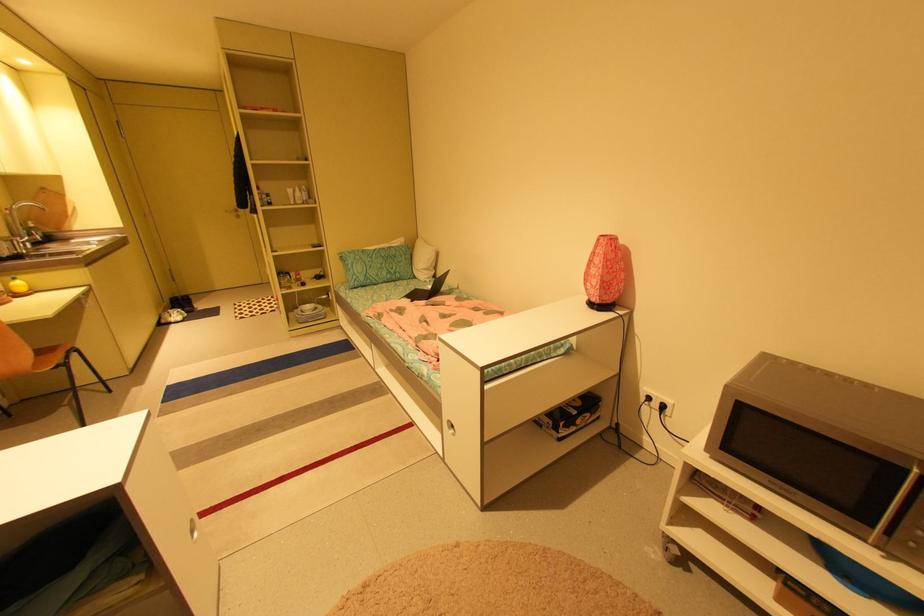
The height and width of the screenshot is (616, 924). What do you see at coordinates (659, 400) in the screenshot? I see `the white power socket` at bounding box center [659, 400].